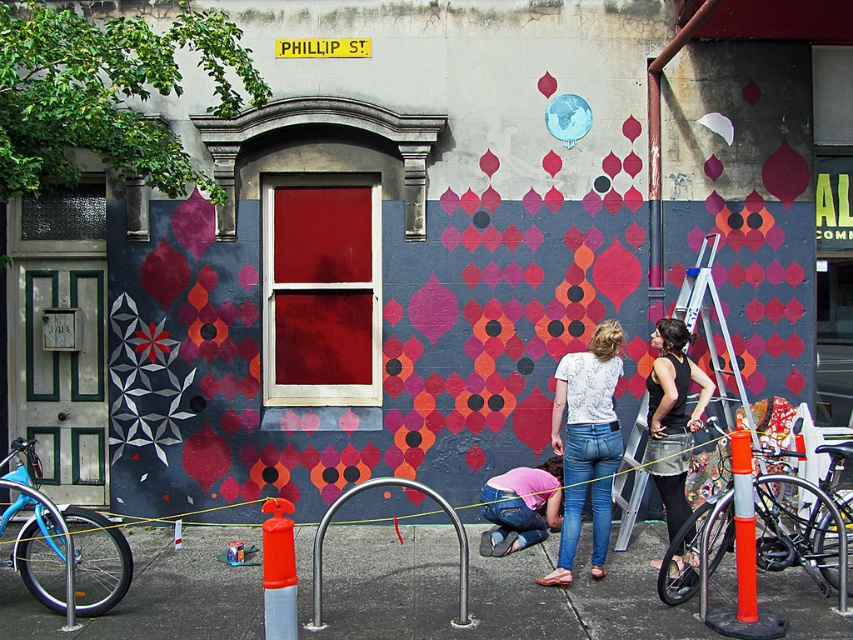
Does point (601, 541) come closer to viewer compared to point (518, 486)?

Yes, it is in front of point (518, 486).

Is white printed shirt at center further to the viewer compared to pink fabric at center?

No, it is not.

Is point (572, 429) positioned behind point (549, 465)?

That is False.

Locate an element on the screen. The height and width of the screenshot is (640, 853). white printed shirt at center is located at coordinates (587, 444).

Is orange rubber bicycle at lower right wider than white printed shirt at center?

Yes, orange rubber bicycle at lower right is wider than white printed shirt at center.

Can you confirm if orange rubber bicycle at lower right is bigger than white printed shirt at center?

Yes.

The width and height of the screenshot is (853, 640). I want to click on orange rubber bicycle at lower right, so click(x=801, y=531).

Between orange rubber bicycle at lower right and blue matte bicycle at left, which one has more height?

With more height is blue matte bicycle at left.

In the scene shown: Is orange rubber bicycle at lower right thinner than blue matte bicycle at left?

In fact, orange rubber bicycle at lower right might be wider than blue matte bicycle at left.

Who is more forward, (817, 520) or (62, 588)?

Positioned in front is point (817, 520).

The width and height of the screenshot is (853, 640). In order to click on orange rubber bicycle at lower right in this screenshot , I will do `click(801, 531)`.